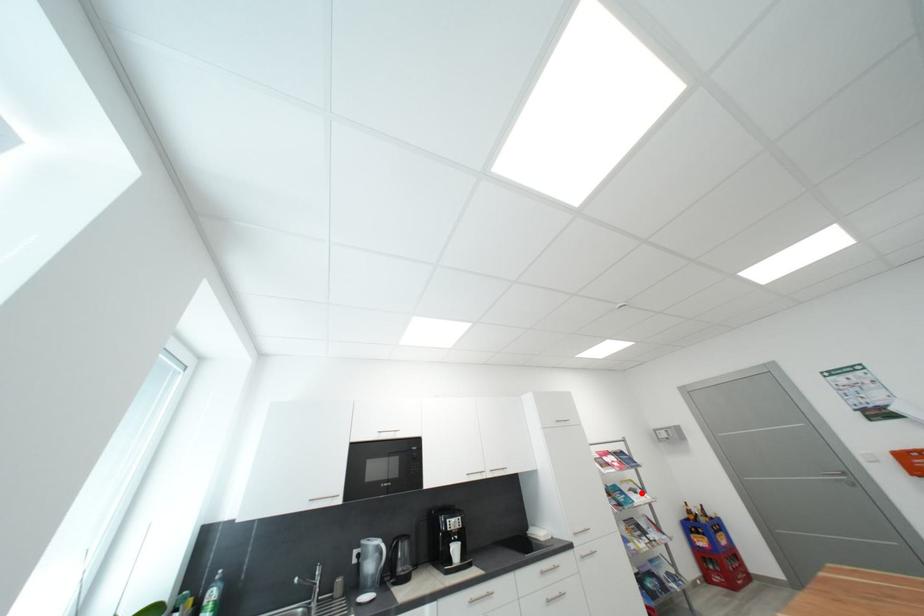
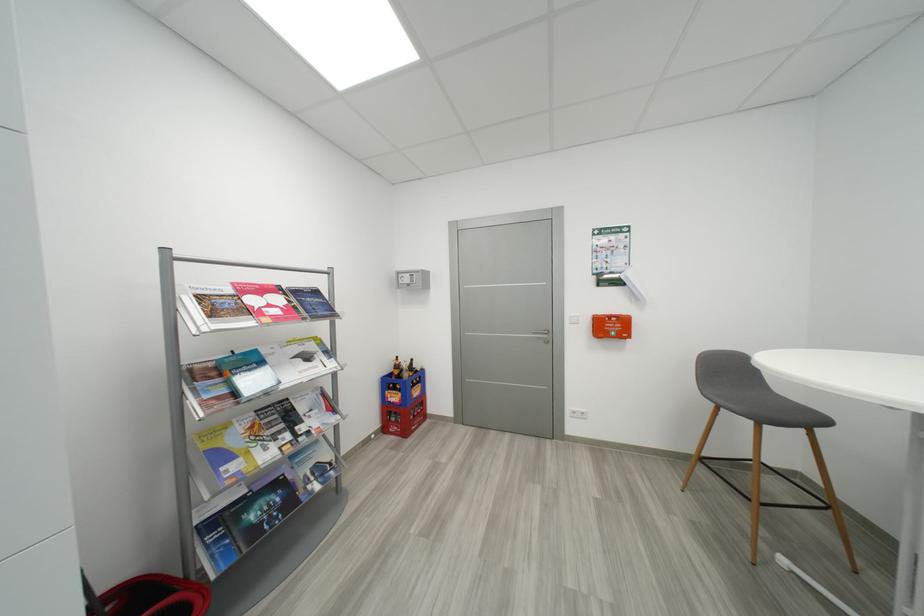
Question: A red point is marked in image1. In image2, is the corresponding 3D point closer to the camera or farther? Reply with the corresponding letter.

Choices:
 (A) The corresponding 3D point is closer.
 (B) The corresponding 3D point is farther.

Answer: (A)